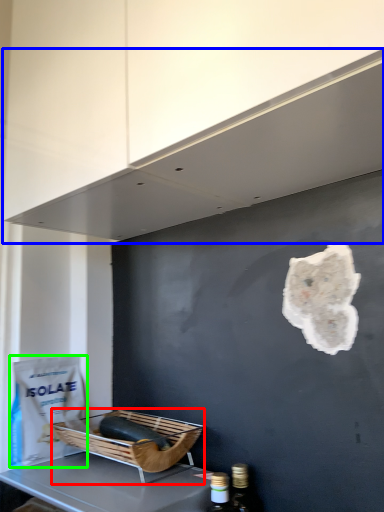
Question: Which object is the farthest from basket (highlighted by a red box)? Choose among these: exhaust hood (highlighted by a blue box) or paper bag (highlighted by a green box).

Choices:
 (A) exhaust hood
 (B) paper bag

Answer: (A)